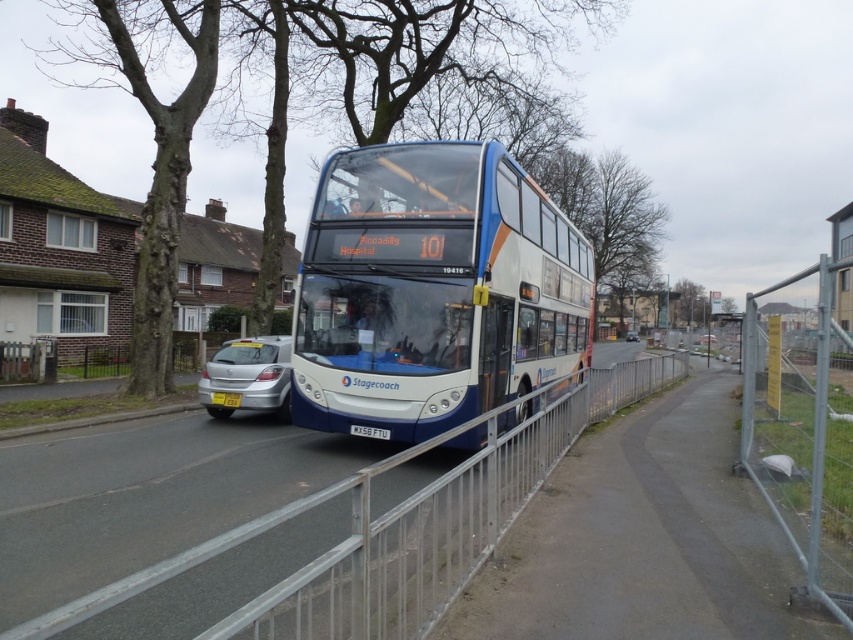
Question: Which of the following is the farthest from the observer?

Choices:
 (A) (708, 336)
 (B) (213, 378)

Answer: (A)

Question: Which of the following is the farthest from the observer?

Choices:
 (A) (822, 266)
 (B) (305, 262)
 (C) (167, 342)

Answer: (C)

Question: Can you confirm if silver metallic rail at center is positioned above metallic silver car at center?

Choices:
 (A) yes
 (B) no

Answer: (B)

Question: Among these points, which one is farthest from the camera?

Choices:
 (A) (170, 312)
 (B) (219, 378)

Answer: (A)

Question: Does metal fence at right appear on the left side of yellow matte license plate at center?

Choices:
 (A) no
 (B) yes

Answer: (A)

Question: Does silver metallic sedan at lower left have a lesser width compared to yellow matte license plate at center?

Choices:
 (A) yes
 (B) no

Answer: (B)